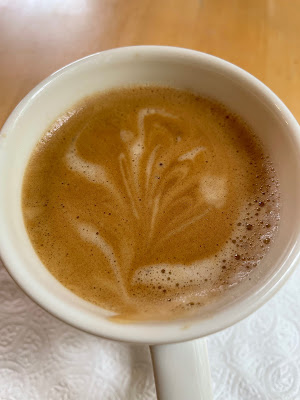
Identify the location of napkins. Image resolution: width=300 pixels, height=400 pixels. (x=269, y=344), (x=39, y=344), (x=89, y=369), (x=12, y=386), (x=229, y=363), (x=259, y=391), (x=293, y=302), (x=113, y=358), (x=73, y=395), (x=13, y=320).